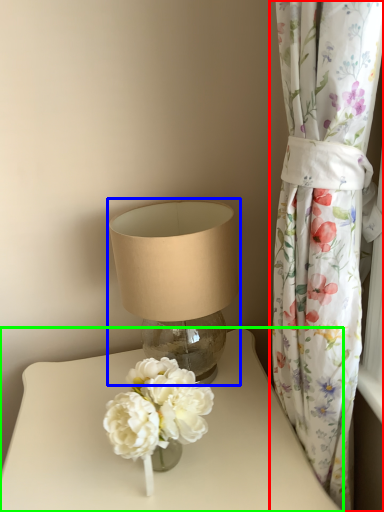
Question: Estimate the real-world distances between objects in this image. Which object is closer to curtain (highlighted by a red box), lamp (highlighted by a blue box) or table (highlighted by a green box)?

Choices:
 (A) lamp
 (B) table

Answer: (A)